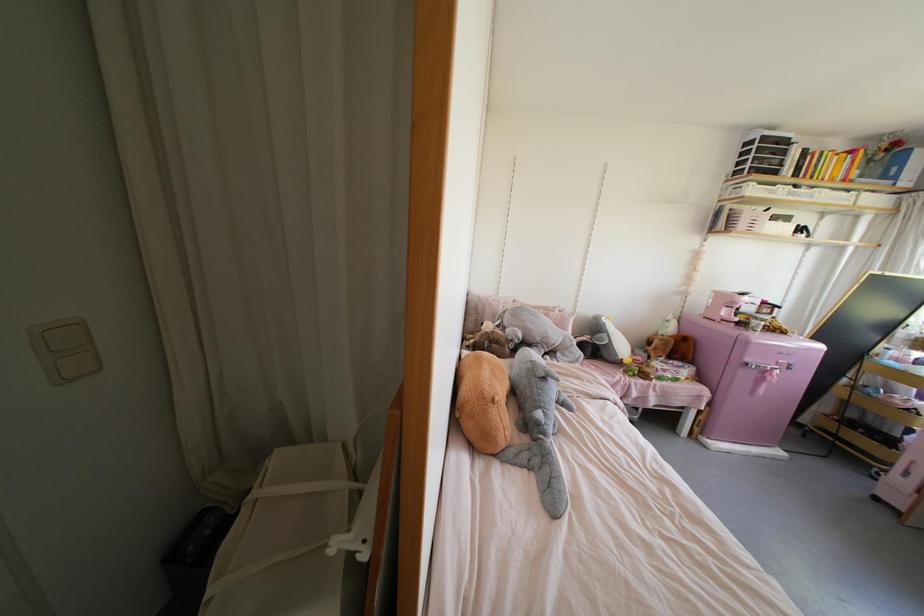
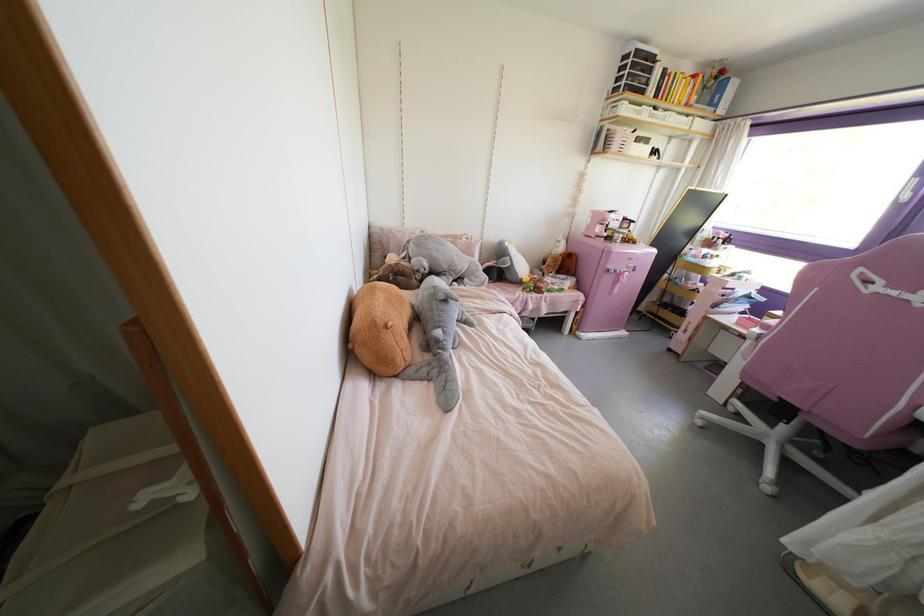
Question: The camera is either moving clockwise (left) or counter-clockwise (right) around the object. The first image is from the beginning of the video and the second image is from the end. Is the camera moving left or right when shooting the video?

Choices:
 (A) Left
 (B) Right

Answer: (A)